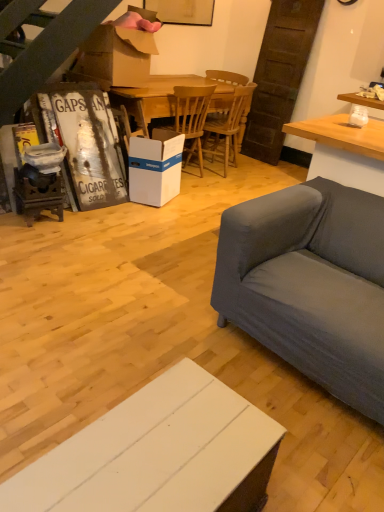
Question: Considering the relative sizes of wooden table at center and white cardboard box at center in the image provided, is wooden table at center bigger than white cardboard box at center?

Choices:
 (A) no
 (B) yes

Answer: (B)

Question: Can you confirm if wooden table at center is positioned to the right of white cardboard box at center?

Choices:
 (A) no
 (B) yes

Answer: (B)

Question: Does wooden table at center touch white cardboard box at center?

Choices:
 (A) yes
 (B) no

Answer: (B)

Question: From a real-world perspective, is wooden table at center below white cardboard box at center?

Choices:
 (A) yes
 (B) no

Answer: (B)

Question: Does wooden table at center lie behind white cardboard box at center?

Choices:
 (A) no
 (B) yes

Answer: (B)

Question: From a real-world perspective, relative to white cardboard box at center, is wooden chair at center, which is the 2th chair in left-to-right order, vertically above or below?

Choices:
 (A) above
 (B) below

Answer: (A)

Question: From the image's perspective, is wooden chair at center, which is the 2th chair in left-to-right order, positioned above or below white cardboard box at center?

Choices:
 (A) above
 (B) below

Answer: (A)

Question: In terms of height, does wooden chair at center, which is the 2th chair in left-to-right order, look taller or shorter compared to white cardboard box at center?

Choices:
 (A) short
 (B) tall

Answer: (B)

Question: Is wooden chair at center, which is the first chair from right to left, spatially inside white cardboard box at center, or outside of it?

Choices:
 (A) inside
 (B) outside

Answer: (B)

Question: Is wooden chair at center, which is the 2th chair in left-to-right order, wider or thinner than wooden at center, which is the second chair in right-to-left order?

Choices:
 (A) wide
 (B) thin

Answer: (B)

Question: From a real-world perspective, is wooden chair at center, which is the 2th chair in left-to-right order, above or below wooden at center, which is the second chair in right-to-left order?

Choices:
 (A) below
 (B) above

Answer: (A)

Question: Is wooden chair at center, which is the first chair from right to left, inside the boundaries of wooden at center, which is the second chair in right-to-left order, or outside?

Choices:
 (A) outside
 (B) inside

Answer: (A)

Question: Considering their positions, is wooden chair at center, which is the first chair from right to left, located in front of or behind wooden at center, positioned as the 1th chair in left-to-right order?

Choices:
 (A) behind
 (B) front

Answer: (A)

Question: From the image's perspective, relative to wooden chair at center, which is the first chair from right to left, is white wood cabinet at lower center above or below?

Choices:
 (A) above
 (B) below

Answer: (B)

Question: In terms of height, does white wood cabinet at lower center look taller or shorter compared to wooden chair at center, which is the 2th chair in left-to-right order?

Choices:
 (A) short
 (B) tall

Answer: (A)